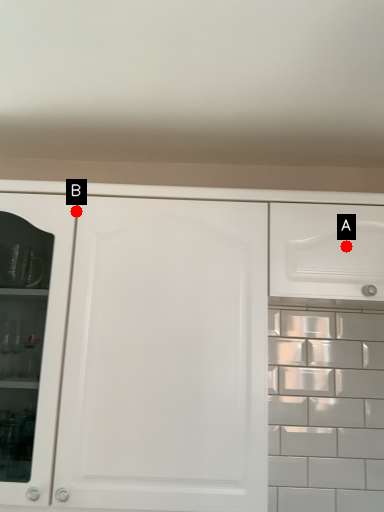
Question: Two points are circled on the image, labeled by A and B beside each circle. Which point is farther from the camera taking this photo?

Choices:
 (A) A is further
 (B) B is further

Answer: (B)